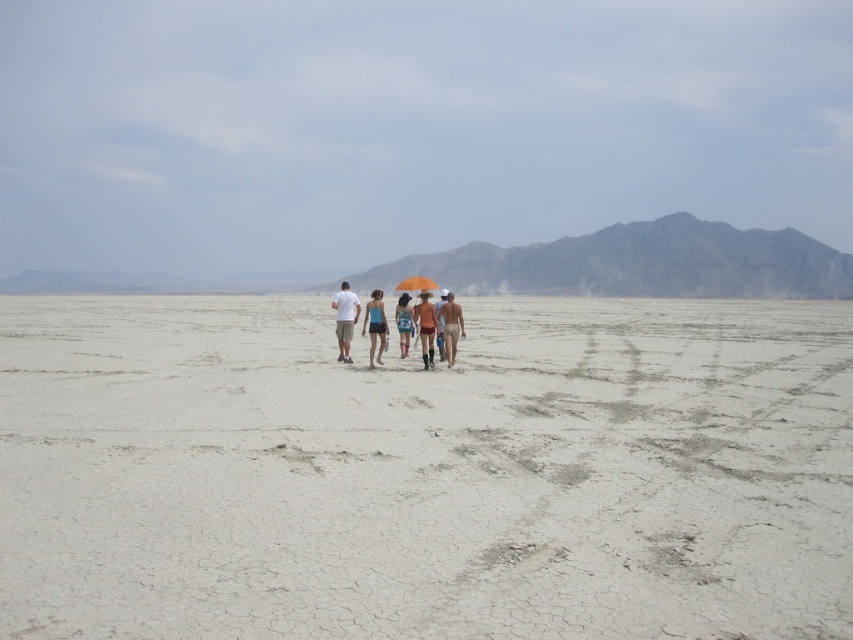
Question: Is white cracked dirt at center positioned at the back of blue fabric shorts at center?

Choices:
 (A) no
 (B) yes

Answer: (A)

Question: Can you confirm if white cotton shirt at center is wider than orange fabric umbrella at center?

Choices:
 (A) no
 (B) yes

Answer: (B)

Question: Which object is farther from the camera taking this photo?

Choices:
 (A) orange matte umbrella at center
 (B) blue fabric shorts at center

Answer: (A)

Question: Which point is closer to the camera?

Choices:
 (A) orange matte umbrella at center
 (B) white cotton shirt at center
 (C) blue fabric shorts at center

Answer: (C)

Question: Can you confirm if white cracked dirt at center is smaller than tan skin person at center?

Choices:
 (A) no
 (B) yes

Answer: (A)

Question: Which point appears closest to the camera in this image?

Choices:
 (A) (448, 296)
 (B) (405, 342)
 (C) (404, 284)
 (D) (370, 346)

Answer: (D)